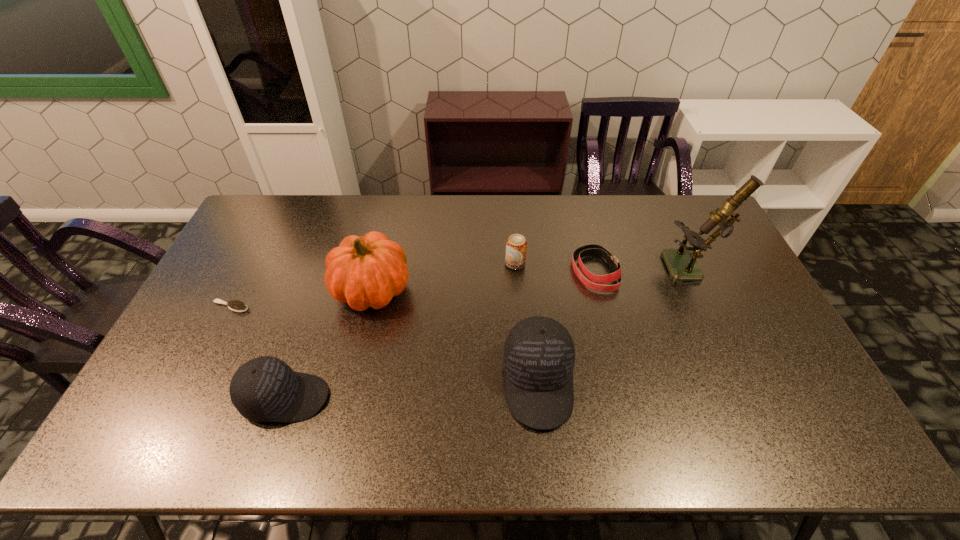
This screenshot has width=960, height=540. What are the coordinates of `object at the right edge` in the screenshot? It's located at (681, 263).

Image resolution: width=960 pixels, height=540 pixels. Identify the location of vacant space at the far edge. 492,234.

This screenshot has height=540, width=960. What are the coordinates of `vacant region at the near edge of the desktop` in the screenshot? It's located at (330, 386).

In the image, there is a desktop. Identify the location of vacant space at the left edge. (205, 316).

In the image, there is a desktop. At what (x,y) coordinates should I click in order to perform the action: click on free space at the right edge. Please return your answer as a coordinate pair (x, y). Looking at the image, I should click on (781, 369).

Identify the location of free location at the near left corner of the desktop. (178, 388).

The height and width of the screenshot is (540, 960). Identify the location of vacant space that's between the left baseball cap and the second object from right to left. [x=441, y=335].

Identify the location of unoccupied area between the sixth object from left to right and the tallest object. (644, 271).

The width and height of the screenshot is (960, 540). Find the location of `vacant area that lies between the beer can and the sixth shortest object`. vacant area that lies between the beer can and the sixth shortest object is located at coordinates (444, 276).

You are a GUI agent. You are given a task and a screenshot of the screen. Output one action in this format:
    pyautogui.click(x=<x>, y=<y>)
    Task: Click on the vacant area that lies between the scrubbing brush and the sixth tallest object
    
    Given the screenshot: What is the action you would take?
    pyautogui.click(x=413, y=289)